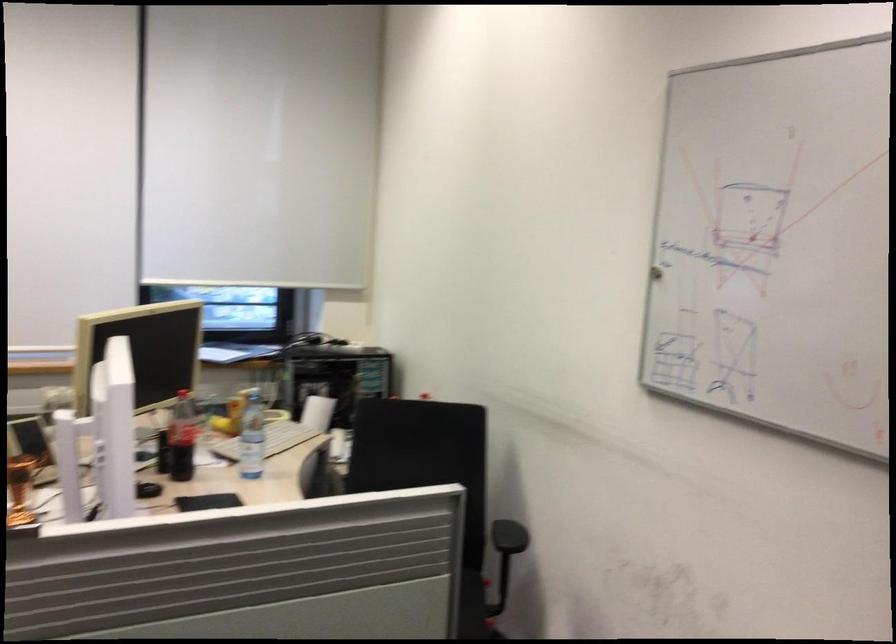
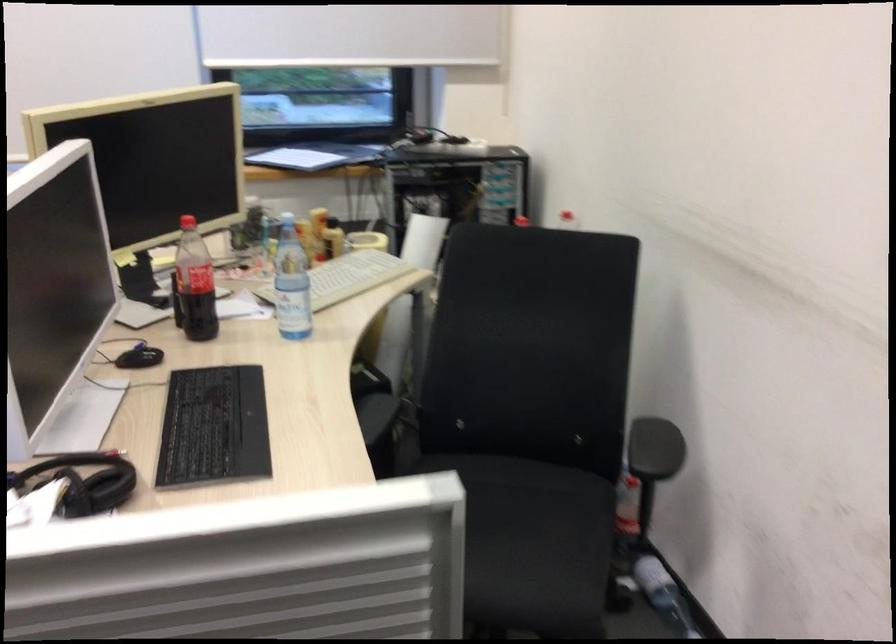
Question: The images are taken continuously from a first-person perspective. In which direction is your viewpoint rotating?

Choices:
 (A) Left
 (B) Right
 (C) Up
 (D) Down

Answer: (D)